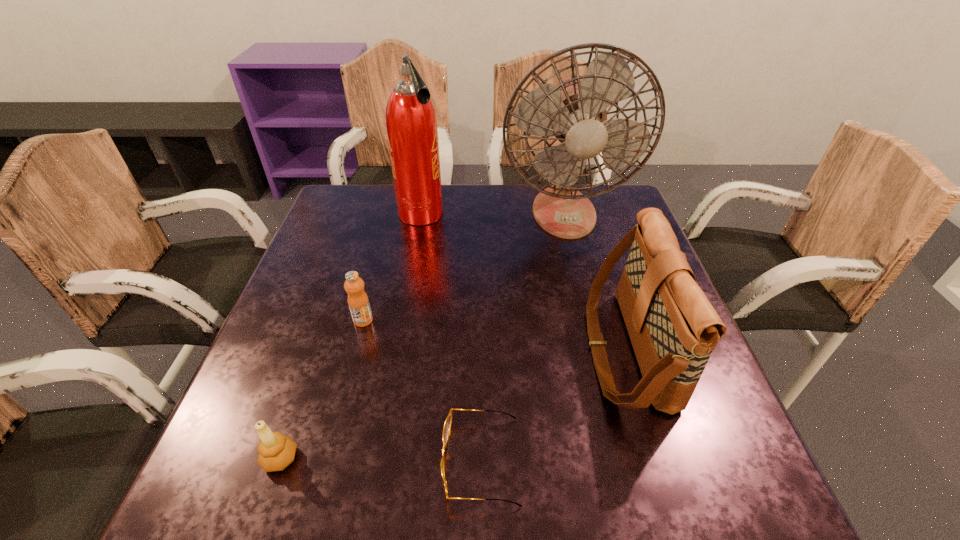
The height and width of the screenshot is (540, 960). Identify the location of vacant space located 0.170m on the front-facing side of the shoulder bag. (506, 349).

You are a GUI agent. You are given a task and a screenshot of the screen. Output one action in this format:
    pyautogui.click(x=<x>, y=<y>)
    Task: Click on the vacant region located 0.350m on the front-facing side of the shoulder bag
    This screenshot has width=960, height=540.
    Given the screenshot: What is the action you would take?
    pyautogui.click(x=419, y=349)

The width and height of the screenshot is (960, 540). I want to click on vacant space positioned on the front label of the orange juice, so click(x=326, y=458).

Locate an element on the screen. vacant space situated on the back of the candle_holder is located at coordinates (298, 410).

Find the location of a particular element. vacant area situated 0.130m on the front-facing side of the shortest object is located at coordinates (365, 461).

Image resolution: width=960 pixels, height=540 pixels. What are the coordinates of `blank space located on the front-facing side of the shortest object` in the screenshot? It's located at (293, 461).

Where is `vacant space located on the front-facing side of the shortest object`? vacant space located on the front-facing side of the shortest object is located at coordinates (341, 461).

The image size is (960, 540). In order to click on fan at the far edge in this screenshot , I will do `click(574, 111)`.

In order to click on fire extinguisher present at the far edge in this screenshot , I will do `click(411, 125)`.

Find the location of `candle_holder that is at the near edge`. candle_holder that is at the near edge is located at coordinates (276, 451).